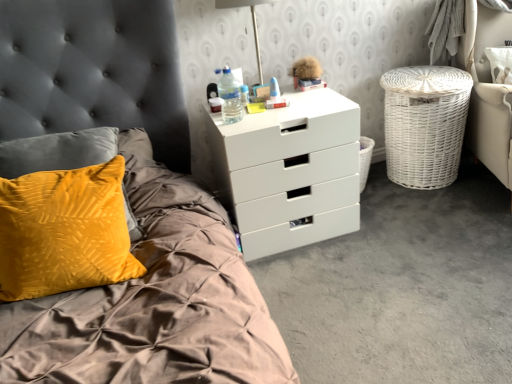
I want to click on vacant area situated below metallic silver lamp at upper center (from a real-world perspective), so click(261, 96).